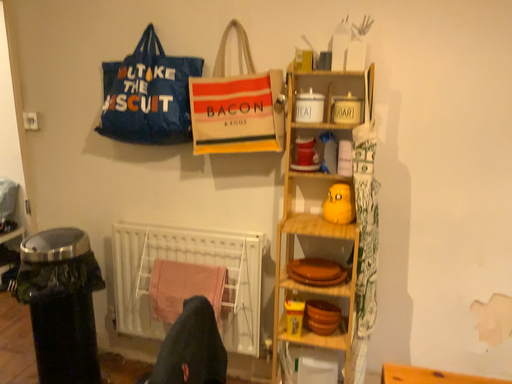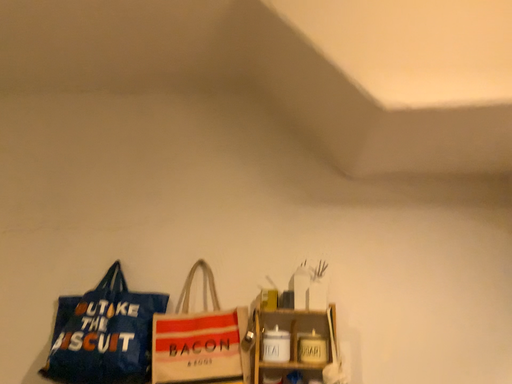
Question: Which way did the camera rotate in the video?

Choices:
 (A) rotated left
 (B) rotated right

Answer: (B)